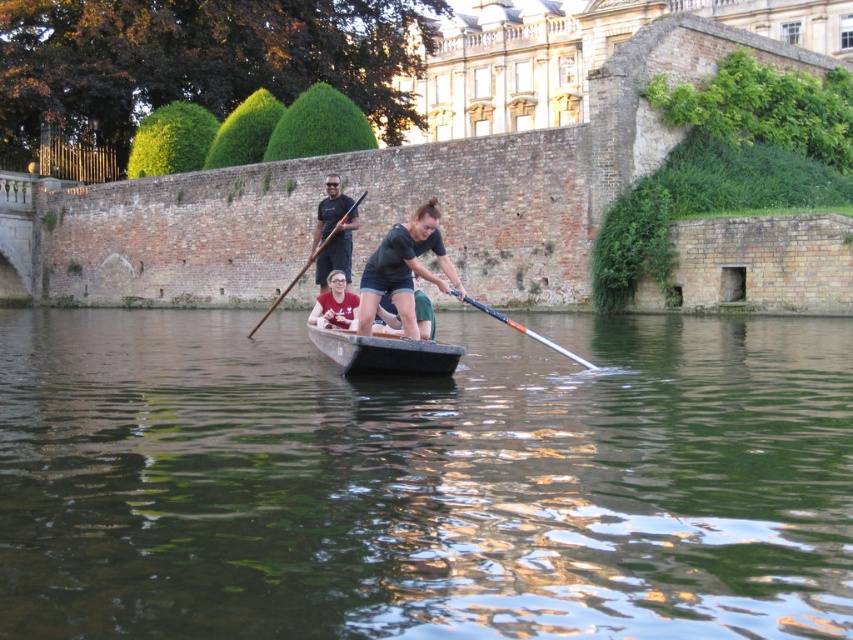
You are observing the boat scene and notice two paddles. The matte black paddle at upper center and the wooden paddle at center. Which paddle is positioned to the right side of the other?

The matte black paddle at upper center is positioned to the right of the wooden paddle at center.

You are a photographer trying to capture the reflection of the matte black paddle at upper center and the wooden paddle at center in the water. Which paddle will have a clearer reflection?

The wooden paddle at center will have a clearer reflection because it is closer to the water surface than the matte black paddle at upper center, which is positioned higher up.